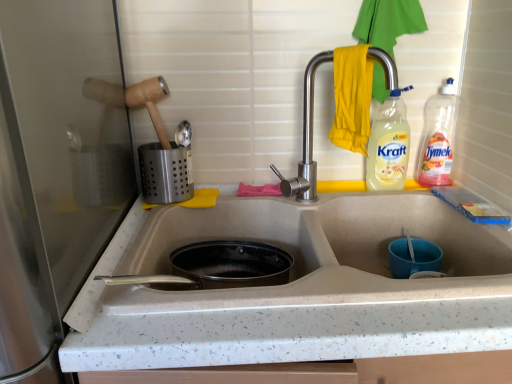
Question: From the image's perspective, is white speckled countertop at left, which appears as the 2th appliance when viewed from the right, above satin silver utensil holder at upper left, which ranks as the 2th appliance in front-to-back order?

Choices:
 (A) yes
 (B) no

Answer: (B)

Question: Can you confirm if white speckled countertop at left, positioned as the 2th appliance in back-to-front order, is thinner than satin silver utensil holder at upper left, arranged as the first appliance when viewed from the right?

Choices:
 (A) yes
 (B) no

Answer: (B)

Question: Is white speckled countertop at left, the first appliance when ordered from bottom to top, smaller than satin silver utensil holder at upper left, the first appliance in the back-to-front sequence?

Choices:
 (A) no
 (B) yes

Answer: (A)

Question: Considering the relative positions of white speckled countertop at left, positioned as the 2th appliance in back-to-front order, and satin silver utensil holder at upper left, positioned as the first appliance in top-to-bottom order, in the image provided, is white speckled countertop at left, positioned as the 2th appliance in back-to-front order, to the right of satin silver utensil holder at upper left, positioned as the first appliance in top-to-bottom order, from the viewer's perspective?

Choices:
 (A) no
 (B) yes

Answer: (A)

Question: Does white speckled countertop at left, which appears as the 2th appliance when viewed from the right, turn towards satin silver utensil holder at upper left, positioned as the second appliance in left-to-right order?

Choices:
 (A) no
 (B) yes

Answer: (A)

Question: Is clear plastic bottle at upper right, which is the second bottle from left to right, taller or shorter than translucent plastic bottle at upper right, which is the 1th bottle from left to right?

Choices:
 (A) short
 (B) tall

Answer: (B)

Question: In the image, is clear plastic bottle at upper right, which is the second bottle from left to right, on the left side or the right side of translucent plastic bottle at upper right, which is the 1th bottle from left to right?

Choices:
 (A) left
 (B) right

Answer: (B)

Question: In terms of width, does clear plastic bottle at upper right, which ranks as the 1th bottle in right-to-left order, look wider or thinner when compared to translucent plastic bottle at upper right, which is the 1th bottle from left to right?

Choices:
 (A) thin
 (B) wide

Answer: (B)

Question: Is clear plastic bottle at upper right, which ranks as the 1th bottle in right-to-left order, in front of or behind translucent plastic bottle at upper right, which is the 1th bottle from left to right, in the image?

Choices:
 (A) front
 (B) behind

Answer: (B)

Question: In terms of width, does satin nickel faucet at center look wider or thinner when compared to translucent plastic bottle at upper right, the second bottle in the right-to-left sequence?

Choices:
 (A) thin
 (B) wide

Answer: (B)

Question: From a real-world perspective, is satin nickel faucet at center positioned above or below translucent plastic bottle at upper right, which is the 1th bottle from left to right?

Choices:
 (A) above
 (B) below

Answer: (A)

Question: Based on their sizes in the image, would you say satin nickel faucet at center is bigger or smaller than translucent plastic bottle at upper right, the second bottle in the right-to-left sequence?

Choices:
 (A) small
 (B) big

Answer: (B)

Question: Would you say satin nickel faucet at center is to the left or to the right of translucent plastic bottle at upper right, which is the 1th bottle from left to right, in the picture?

Choices:
 (A) right
 (B) left

Answer: (B)

Question: From the image's perspective, is translucent plastic bottle at upper right, the second bottle in the right-to-left sequence, above or below yellow fabric hand towel at upper right?

Choices:
 (A) above
 (B) below

Answer: (B)

Question: Visually, is translucent plastic bottle at upper right, which is the 1th bottle from left to right, positioned to the left or to the right of yellow fabric hand towel at upper right?

Choices:
 (A) left
 (B) right

Answer: (B)